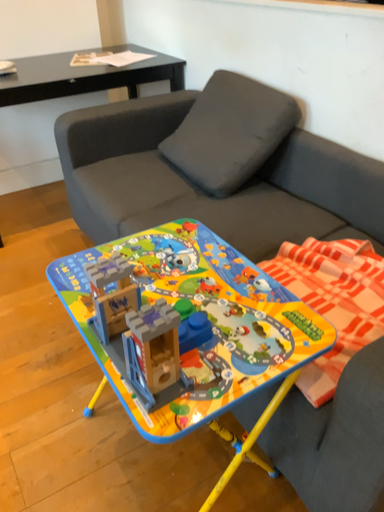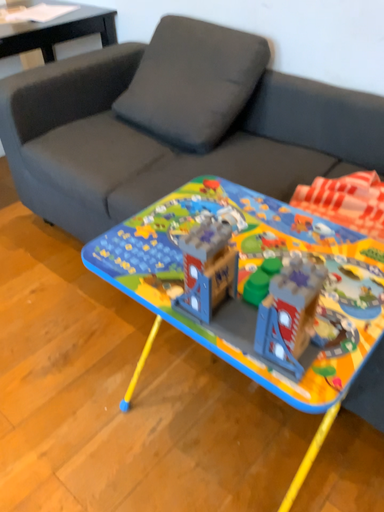
Question: How did the camera likely rotate when shooting the video?

Choices:
 (A) rotated right
 (B) rotated left

Answer: (A)